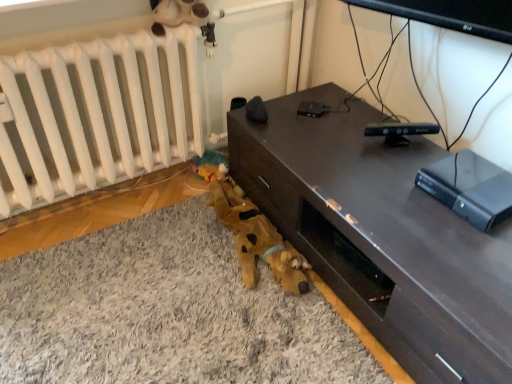
Find the location of a particular element. The image size is (512, 384). free spot in front of black plastic gaming console at right is located at coordinates (469, 249).